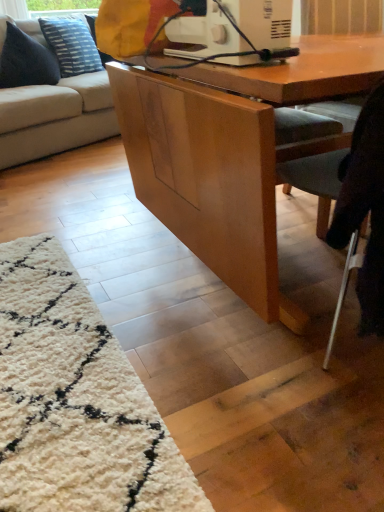
Question: Can you confirm if light gray fabric chair at lower right is positioned to the left of dark blue fabric pillow at upper left, which ranks as the second pillow in back-to-front order?

Choices:
 (A) yes
 (B) no

Answer: (B)

Question: Does light gray fabric chair at lower right have a greater height compared to dark blue fabric pillow at upper left, which ranks as the 1th pillow in front-to-back order?

Choices:
 (A) yes
 (B) no

Answer: (A)

Question: Are light gray fabric chair at lower right and dark blue fabric pillow at upper left, which ranks as the 1th pillow in front-to-back order, far apart?

Choices:
 (A) yes
 (B) no

Answer: (A)

Question: Does light gray fabric chair at lower right lie behind dark blue fabric pillow at upper left, which ranks as the second pillow in back-to-front order?

Choices:
 (A) no
 (B) yes

Answer: (A)

Question: Is light gray fabric chair at lower right bigger than dark blue fabric pillow at upper left, which ranks as the second pillow in back-to-front order?

Choices:
 (A) no
 (B) yes

Answer: (B)

Question: From a real-world perspective, relative to beige fabric couch at left, is light gray fabric chair at lower right vertically above or below?

Choices:
 (A) above
 (B) below

Answer: (B)

Question: Is light gray fabric chair at lower right in front of or behind beige fabric couch at left in the image?

Choices:
 (A) front
 (B) behind

Answer: (A)

Question: Considering the positions of light gray fabric chair at lower right and beige fabric couch at left in the image, is light gray fabric chair at lower right taller or shorter than beige fabric couch at left?

Choices:
 (A) tall
 (B) short

Answer: (B)

Question: Is light gray fabric chair at lower right bigger or smaller than beige fabric couch at left?

Choices:
 (A) small
 (B) big

Answer: (A)

Question: Looking at the image, does dark blue fabric pillow at upper left, which ranks as the second pillow in back-to-front order, seem bigger or smaller compared to beige fabric couch at left?

Choices:
 (A) big
 (B) small

Answer: (B)

Question: Is dark blue fabric pillow at upper left, which ranks as the second pillow in back-to-front order, wider or thinner than beige fabric couch at left?

Choices:
 (A) thin
 (B) wide

Answer: (A)

Question: From a real-world perspective, is dark blue fabric pillow at upper left, which ranks as the second pillow in back-to-front order, above or below beige fabric couch at left?

Choices:
 (A) below
 (B) above

Answer: (B)

Question: From the image's perspective, relative to beige fabric couch at left, is dark blue fabric pillow at upper left, which ranks as the 1th pillow in front-to-back order, above or below?

Choices:
 (A) below
 (B) above

Answer: (B)

Question: Is blue textured pillow at upper left, the first pillow from the back, inside or outside of white plastic sewing machine at upper center?

Choices:
 (A) inside
 (B) outside

Answer: (B)

Question: From a real-world perspective, is blue textured pillow at upper left, the second pillow when ordered from front to back, positioned above or below white plastic sewing machine at upper center?

Choices:
 (A) above
 (B) below

Answer: (B)